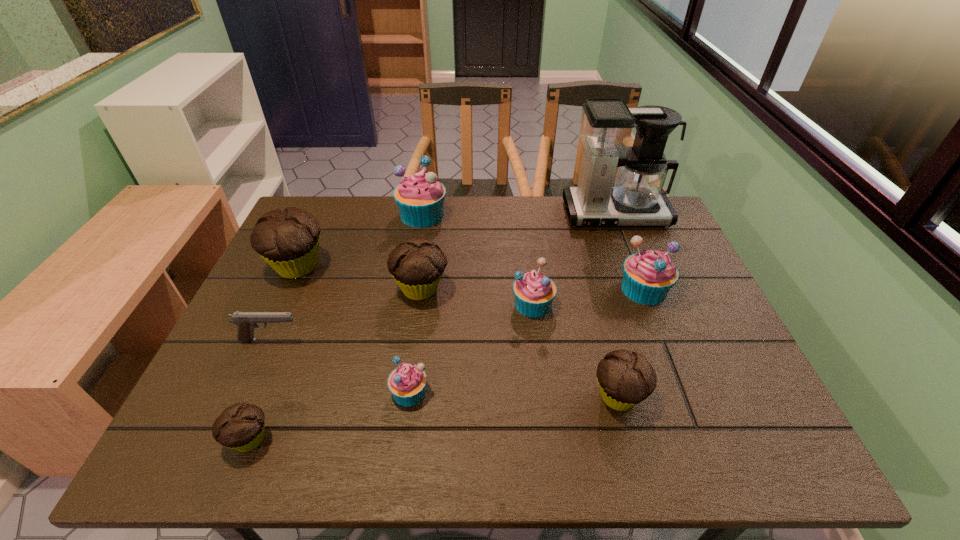
I want to click on object located at the near left corner, so click(240, 427).

I want to click on object present at the far right corner, so click(607, 126).

Find the location of a particular element. This screenshot has width=960, height=540. free point at the far edge is located at coordinates (439, 227).

In the image, there is a desktop. Find the location of `free space at the near edge`. free space at the near edge is located at coordinates (545, 427).

This screenshot has width=960, height=540. Find the location of `free space at the left edge of the desktop`. free space at the left edge of the desktop is located at coordinates (300, 302).

The image size is (960, 540). Identify the location of free region at the right edge of the desktop. (698, 361).

This screenshot has height=540, width=960. In the image, there is a desktop. Find the location of `vacant space at the near left corner`. vacant space at the near left corner is located at coordinates (238, 456).

Locate an element on the screen. The width and height of the screenshot is (960, 540). vacant region between the nearest blue muffin and the sixth muffin from left to right is located at coordinates (471, 348).

Identify the location of vacant region between the nearest blue muffin and the second biggest blue muffin. (527, 340).

Identify the location of free spot between the biggest chocolate muffin and the coffee maker. click(457, 240).